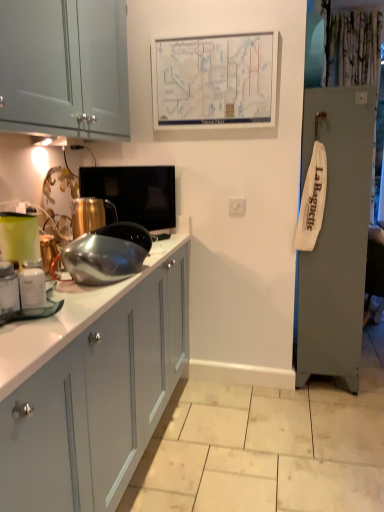
Where is `vacant space situated above white paper map at upper center (from a real-world perspective)`? The image size is (384, 512). vacant space situated above white paper map at upper center (from a real-world perspective) is located at coordinates (209, 31).